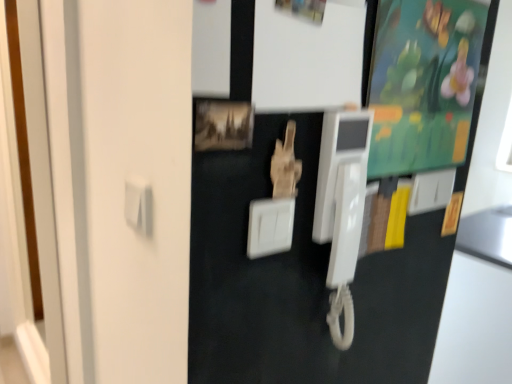
Locate an element on the screen. The image size is (512, 384). white plastic light switch at center, the 2th light switch viewed from the back is located at coordinates (270, 226).

Locate an element on the screen. The image size is (512, 384). white plastic light switch at upper right, the first light switch positioned from the back is located at coordinates (431, 191).

What do you see at coordinates (423, 83) in the screenshot?
I see `green matte bulletin board at upper right` at bounding box center [423, 83].

Image resolution: width=512 pixels, height=384 pixels. Identify the location of wooden photo frame at center. (223, 125).

Locate an element on the screen. Image resolution: width=512 pixels, height=384 pixels. white plastic light switch at center, which is counted as the 1th light switch, starting from the front is located at coordinates (270, 226).

Considering the relative sizes of white plastic light switch at upper right, which ranks as the 1th light switch in right-to-left order, and wooden photo frame at center in the image provided, is white plastic light switch at upper right, which ranks as the 1th light switch in right-to-left order, smaller than wooden photo frame at center?

No.

Does white plastic light switch at upper right, acting as the 2th light switch starting from the left, have a greater height compared to wooden photo frame at center?

Correct, white plastic light switch at upper right, acting as the 2th light switch starting from the left, is much taller as wooden photo frame at center.

From the picture: Visually, is wooden photo frame at center positioned to the left or to the right of white plastic light switch at upper right, acting as the 2th light switch starting from the left?

In the image, wooden photo frame at center appears on the left side of white plastic light switch at upper right, acting as the 2th light switch starting from the left.

Can you tell me how much wooden photo frame at center and white plastic light switch at upper right, acting as the 2th light switch starting from the left, differ in facing direction?

They differ by 0.706 degrees in their facing directions.

Can you confirm if wooden photo frame at center is shorter than white plastic light switch at upper right, which ranks as the 1th light switch in right-to-left order?

Yes.

Considering the positions of objects wooden photo frame at center and white plastic light switch at upper right, the first light switch positioned from the back, in the image provided, who is behind, wooden photo frame at center or white plastic light switch at upper right, the first light switch positioned from the back,?

Positioned behind is white plastic light switch at upper right, the first light switch positioned from the back.

Is green matte bulletin board at upper right with white plastic light switch at center, the 2th light switch viewed from the back?

No, green matte bulletin board at upper right is not beside white plastic light switch at center, the 2th light switch viewed from the back.

Locate an element on the screen. Image resolution: width=512 pixels, height=384 pixels. light switch in front of the green matte bulletin board at upper right is located at coordinates (270, 226).

Is green matte bulletin board at upper right in front of white plastic light switch at center, acting as the 2th light switch starting from the right?

No, it is not.

Would you say green matte bulletin board at upper right is to the left or to the right of white plastic light switch at center, which is counted as the 1th light switch, starting from the front, in the picture?

In the image, green matte bulletin board at upper right appears on the right side of white plastic light switch at center, which is counted as the 1th light switch, starting from the front.

Does white plastic light switch at center, which is counted as the 1th light switch, starting from the front, have a smaller size compared to white plastic light switch at upper right, acting as the 2th light switch starting from the left?

Yes, white plastic light switch at center, which is counted as the 1th light switch, starting from the front, is smaller than white plastic light switch at upper right, acting as the 2th light switch starting from the left.

Which object is positioned more to the right, white plastic light switch at center, which is counted as the first light switch, starting from the left, or white plastic light switch at upper right, the first light switch positioned from the back?

white plastic light switch at upper right, the first light switch positioned from the back, is more to the right.

From the image's perspective, is white plastic light switch at center, acting as the 2th light switch starting from the right, located beneath white plastic light switch at upper right, acting as the 2th light switch starting from the left?

Yes, from the image's perspective, white plastic light switch at center, acting as the 2th light switch starting from the right, is beneath white plastic light switch at upper right, acting as the 2th light switch starting from the left.

Is white plastic payphone at center looking in the opposite direction of green matte bulletin board at upper right?

No, white plastic payphone at center's orientation is not away from green matte bulletin board at upper right.

Can you see white plastic payphone at center touching green matte bulletin board at upper right?

white plastic payphone at center and green matte bulletin board at upper right are clearly separated.

Does point (334, 182) appear closer or farther from the camera than point (383, 106)?

Point (334, 182) is positioned closer to the camera compared to point (383, 106).

Considering their positions, is white plastic payphone at center located in front of or behind green matte bulletin board at upper right?

In the image, white plastic payphone at center appears in front of green matte bulletin board at upper right.

Could you measure the distance between white plastic light switch at upper right, which ranks as the 1th light switch in right-to-left order, and white plastic light switch at center, which is counted as the 1th light switch, starting from the front?

15.10 inches.

Considering the sizes of objects white plastic light switch at upper right, acting as the 2th light switch starting from the left, and white plastic light switch at center, acting as the 2th light switch starting from the right, in the image provided, who is thinner, white plastic light switch at upper right, acting as the 2th light switch starting from the left, or white plastic light switch at center, acting as the 2th light switch starting from the right,?

white plastic light switch at upper right, acting as the 2th light switch starting from the left, is thinner.

Is white plastic light switch at upper right, the first light switch positioned from the back, oriented away from white plastic light switch at center, which is counted as the first light switch, starting from the left?

That's not correct — white plastic light switch at upper right, the first light switch positioned from the back, is not looking away from white plastic light switch at center, which is counted as the first light switch, starting from the left.

Considering the sizes of white plastic light switch at upper right, the first light switch positioned from the back, and white plastic light switch at center, which is counted as the 1th light switch, starting from the front, in the image, is white plastic light switch at upper right, the first light switch positioned from the back, taller or shorter than white plastic light switch at center, which is counted as the 1th light switch, starting from the front,?

Considering their sizes, white plastic light switch at upper right, the first light switch positioned from the back, has more height than white plastic light switch at center, which is counted as the 1th light switch, starting from the front.

What's the angular difference between white plastic payphone at center and white plastic light switch at upper right, the first light switch positioned from the back,'s facing directions?

The facing directions of white plastic payphone at center and white plastic light switch at upper right, the first light switch positioned from the back, are 0.0046 degrees apart.

Does white plastic payphone at center touch white plastic light switch at upper right, which ranks as the 1th light switch in right-to-left order?

No, white plastic payphone at center is not beside white plastic light switch at upper right, which ranks as the 1th light switch in right-to-left order.

Choose the correct answer: Is white plastic payphone at center inside white plastic light switch at upper right, which ranks as the 1th light switch in right-to-left order, or outside it?

The correct answer is: outside.

Who is taller, white plastic payphone at center or white plastic light switch at upper right, which ranks as the 1th light switch in right-to-left order?

white plastic payphone at center.

Where is `picture frame above the white plastic light switch at upper right, acting as the 2th light switch starting from the left (from the image's perspective)`? picture frame above the white plastic light switch at upper right, acting as the 2th light switch starting from the left (from the image's perspective) is located at coordinates point(223,125).

I want to click on the 1st light switch positioned below the wooden photo frame at center (from a real-world perspective), so click(431, 191).

Looking at the image, which one is located closer to white plastic payphone at center, green matte bulletin board at upper right or white plastic light switch at center, which is counted as the first light switch, starting from the left?

white plastic light switch at center, which is counted as the first light switch, starting from the left, lies closer to white plastic payphone at center than the other object.

Estimate the real-world distances between objects in this image. Which object is closer to white plastic light switch at upper right, the second light switch viewed from the front, wooden photo frame at center or white plastic light switch at center, which is counted as the first light switch, starting from the left?

white plastic light switch at center, which is counted as the first light switch, starting from the left, lies closer to white plastic light switch at upper right, the second light switch viewed from the front, than the other object.

Which object lies nearer to the anchor point green matte bulletin board at upper right, white plastic light switch at center, which is counted as the first light switch, starting from the left, or white plastic light switch at upper right, acting as the 2th light switch starting from the left?

white plastic light switch at upper right, acting as the 2th light switch starting from the left.

Which object lies nearer to the anchor point white plastic payphone at center, green matte bulletin board at upper right or wooden photo frame at center?

Based on the image, green matte bulletin board at upper right appears to be nearer to white plastic payphone at center.

Estimate the real-world distances between objects in this image. Which object is closer to green matte bulletin board at upper right, white plastic payphone at center or wooden photo frame at center?

white plastic payphone at center is closer to green matte bulletin board at upper right.

In the scene shown: Estimate the real-world distances between objects in this image. Which object is closer to wooden photo frame at center, white plastic light switch at upper right, the first light switch positioned from the back, or green matte bulletin board at upper right?

Based on the image, green matte bulletin board at upper right appears to be nearer to wooden photo frame at center.

Which object lies further to the anchor point wooden photo frame at center, white plastic light switch at center, acting as the 2th light switch starting from the right, or white plastic light switch at upper right, which ranks as the 1th light switch in right-to-left order?

white plastic light switch at upper right, which ranks as the 1th light switch in right-to-left order, is further to wooden photo frame at center.

When comparing their distances from green matte bulletin board at upper right, does white plastic light switch at upper right, which ranks as the 1th light switch in right-to-left order, or white plastic light switch at center, which is counted as the 1th light switch, starting from the front, seem further?

Based on the image, white plastic light switch at center, which is counted as the 1th light switch, starting from the front, appears to be further to green matte bulletin board at upper right.

Find the location of a particular element. light switch between wooden photo frame at center and green matte bulletin board at upper right is located at coordinates point(270,226).

You are a GUI agent. You are given a task and a screenshot of the screen. Output one action in this format:
    pyautogui.click(x=<x>, y=<y>)
    Task: Click on the bulletin board between white plastic light switch at center, acting as the 2th light switch starting from the right, and white plastic light switch at upper right, the second light switch viewed from the front, from left to right
    The height and width of the screenshot is (384, 512).
    Given the screenshot: What is the action you would take?
    pyautogui.click(x=423, y=83)

Find the location of a particular element. The width and height of the screenshot is (512, 384). payphone between wooden photo frame at center and green matte bulletin board at upper right in the horizontal direction is located at coordinates (342, 210).

I want to click on payphone between white plastic light switch at center, which is counted as the first light switch, starting from the left, and white plastic light switch at upper right, which ranks as the 1th light switch in right-to-left order, so click(x=342, y=210).